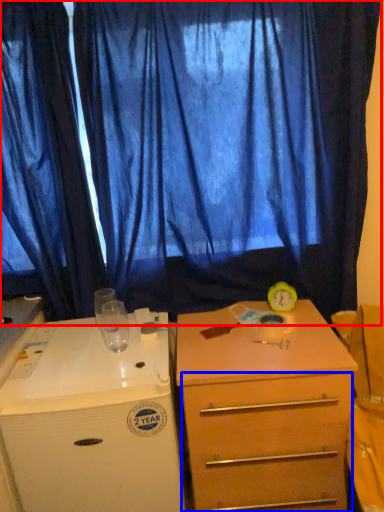
Question: Which point is closer to the camera, curtain (highlighted by a red box) or drawer (highlighted by a blue box)?

Choices:
 (A) curtain
 (B) drawer

Answer: (B)